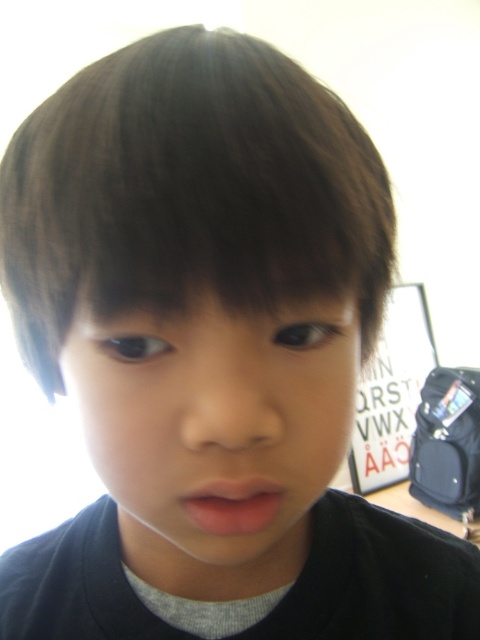
Based on the photo, does smooth skin face at center have a greater width compared to pink matte lips at center?

Correct, the width of smooth skin face at center exceeds that of pink matte lips at center.

The image size is (480, 640). What do you see at coordinates (216, 426) in the screenshot? I see `smooth skin face at center` at bounding box center [216, 426].

Between point (359, 355) and point (228, 493), which one is positioned behind?

The point (359, 355) is more distant.

Where is `smooth skin face at center`? This screenshot has height=640, width=480. smooth skin face at center is located at coordinates (216, 426).